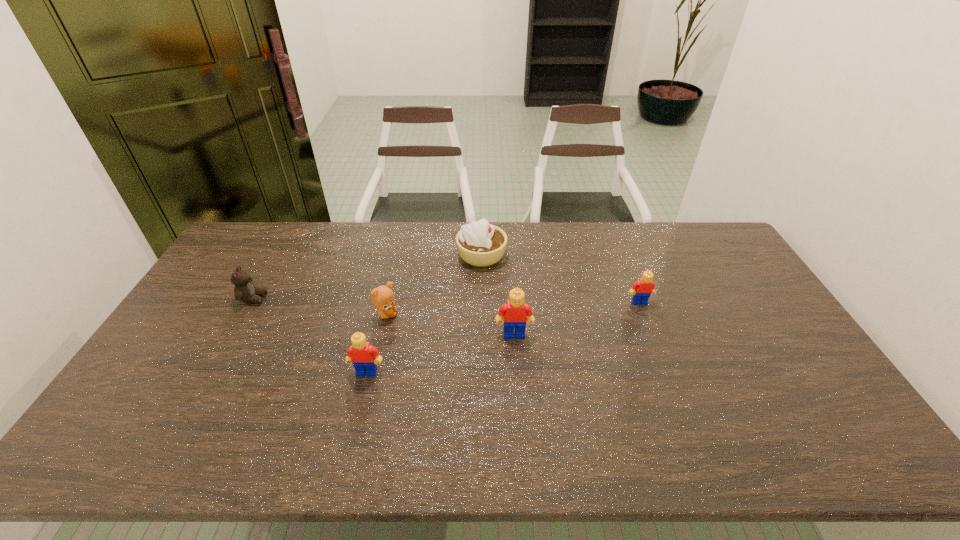
Find the location of a particular element. The height and width of the screenshot is (540, 960). the leftmost Lego is located at coordinates (361, 354).

In order to click on the nearest Lego in this screenshot , I will do `click(361, 354)`.

Locate an element on the screen. the fifth farthest object is located at coordinates (515, 311).

The width and height of the screenshot is (960, 540). In order to click on the second Lego from left to right in this screenshot , I will do `click(515, 311)`.

Where is `the rightmost object`? the rightmost object is located at coordinates (642, 289).

You are a GUI agent. You are given a task and a screenshot of the screen. Output one action in this format:
    pyautogui.click(x=<x>, y=<y>)
    Task: Click on the rightmost Lego
    
    Given the screenshot: What is the action you would take?
    pyautogui.click(x=642, y=289)

The width and height of the screenshot is (960, 540). I want to click on whipped cream, so click(481, 244).

Locate an element on the screen. The height and width of the screenshot is (540, 960). the leftmost object is located at coordinates (244, 290).

Find the location of `the right teddy bear`. the right teddy bear is located at coordinates (382, 297).

You are a GUI agent. You are given a task and a screenshot of the screen. Output one action in this format:
    pyautogui.click(x=<x>, y=<y>)
    Task: Click on the blank area located on the face of the nearest object
    
    Given the screenshot: What is the action you would take?
    pyautogui.click(x=357, y=414)